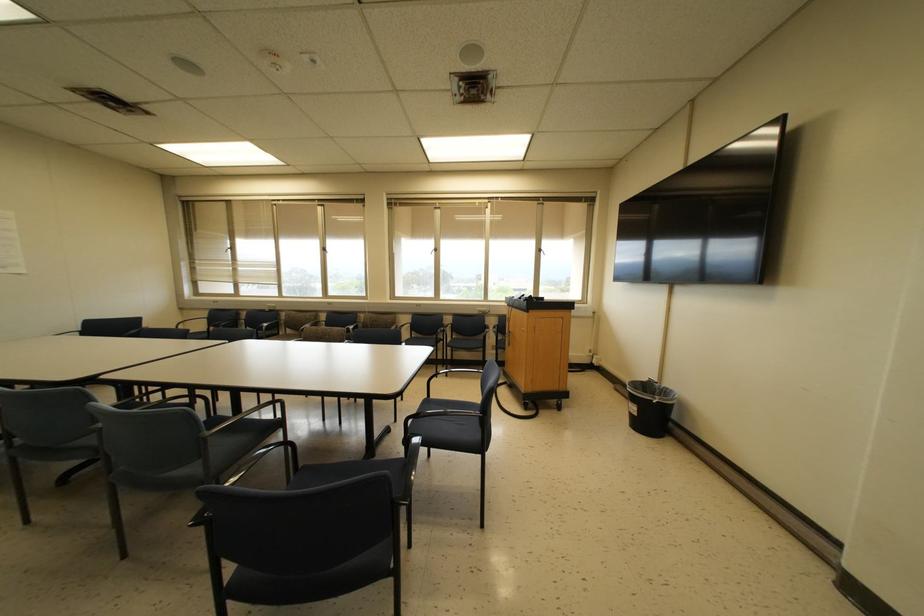
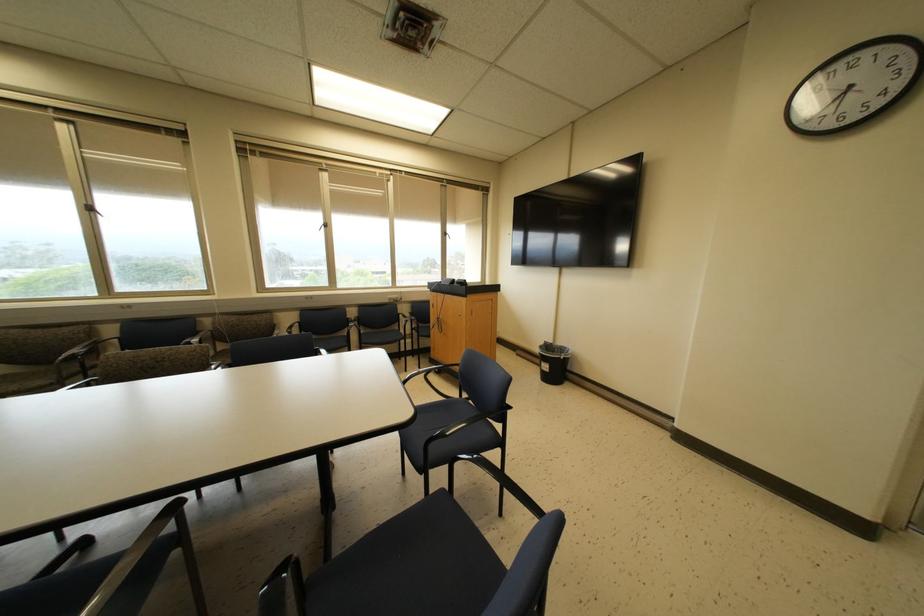
In the second image, find the point that corresponds to point 665,392 in the first image.

(562, 349)